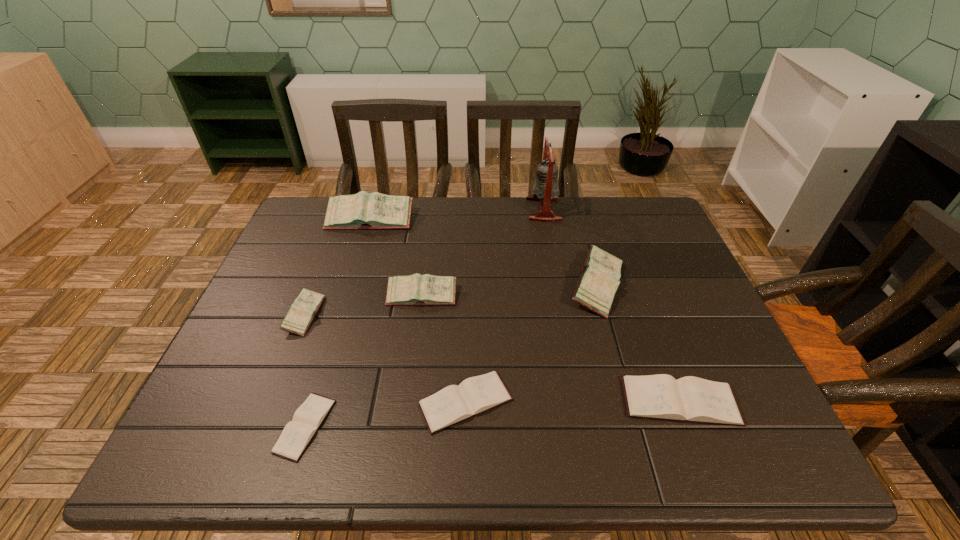
Locate an element on the screen. Image resolution: width=960 pixels, height=540 pixels. vacant space that's between the smallest pink diary and the second shortest object is located at coordinates (385, 359).

I want to click on free space that is in between the shortest object and the sixth tallest diary, so click(x=386, y=414).

Where is `unoccupied position between the second brown diary from right to left and the leftmost brown diary`? The height and width of the screenshot is (540, 960). unoccupied position between the second brown diary from right to left and the leftmost brown diary is located at coordinates (386, 414).

The image size is (960, 540). Find the location of `free space between the third shortest diary and the farthest diary`. free space between the third shortest diary and the farthest diary is located at coordinates (525, 310).

Locate which object ranks fourth in proximity to the second biggest brown diary. Please provide its 2D coordinates. Your answer should be formatted as a tuple, i.e. [(x, y)], where the tuple contains the x and y coordinates of a point satisfying the conditions above.

[(688, 399)]

Select which object appears as the closest to the third smallest pink diary. Please provide its 2D coordinates. Your answer should be formatted as a tuple, i.e. [(x, y)], where the tuple contains the x and y coordinates of a point satisfying the conditions above.

[(545, 189)]

Locate which diary ranks second in proximity to the shortest object. Please provide its 2D coordinates. Your answer should be formatted as a tuple, i.e. [(x, y)], where the tuple contains the x and y coordinates of a point satisfying the conditions above.

[(455, 403)]

Identify which diary is the sixth nearest to the fourth tallest diary. Please provide its 2D coordinates. Your answer should be formatted as a tuple, i.e. [(x, y)], where the tuple contains the x and y coordinates of a point satisfying the conditions above.

[(688, 399)]

Where is `the second closest pink diary relative to the third biggest pink diary`? the second closest pink diary relative to the third biggest pink diary is located at coordinates (364, 210).

Identify which pink diary is the third closest to the third smallest pink diary. Please provide its 2D coordinates. Your answer should be formatted as a tuple, i.e. [(x, y)], where the tuple contains the x and y coordinates of a point satisfying the conditions above.

[(302, 312)]